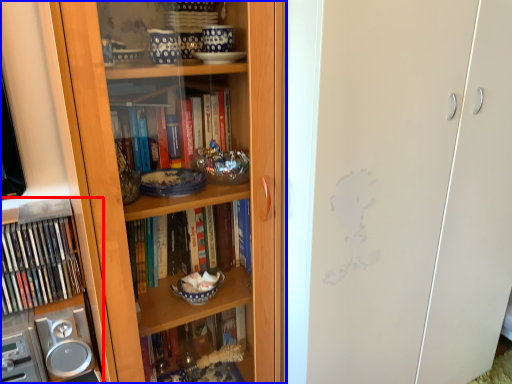
Question: Which point is further to the camera, cabinet (highlighted by a red box) or bookcase (highlighted by a blue box)?

Choices:
 (A) cabinet
 (B) bookcase

Answer: (A)